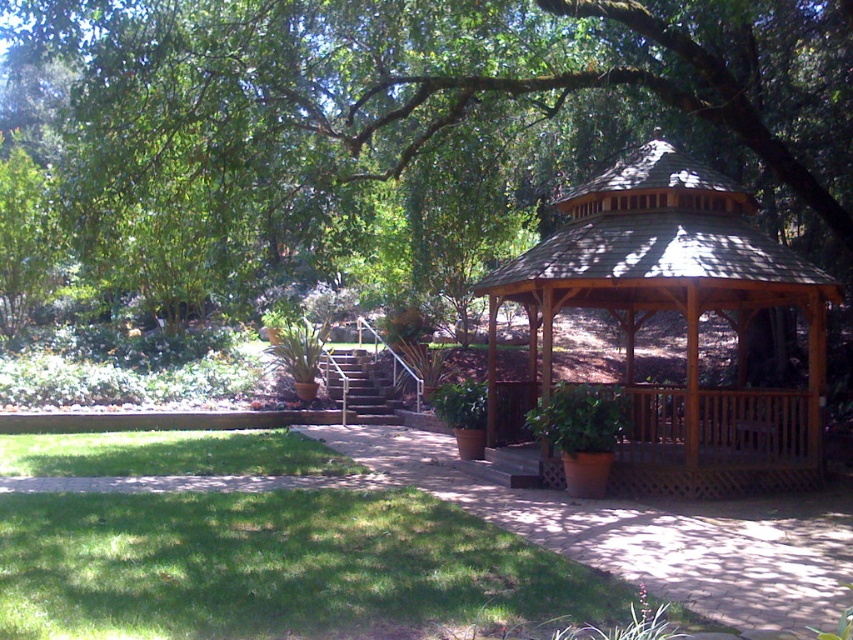
Question: Can you confirm if green leafy tree at center is positioned below green grass at lower left?

Choices:
 (A) yes
 (B) no

Answer: (B)

Question: Can you confirm if green grass at lower left is wider than wooden gazebo at center?

Choices:
 (A) yes
 (B) no

Answer: (A)

Question: Is green leafy tree at center bigger than brown wooden path at center?

Choices:
 (A) yes
 (B) no

Answer: (A)

Question: Among these points, which one is farthest from the camera?

Choices:
 (A) (817, 556)
 (B) (581, 237)
 (C) (186, 224)
 (D) (215, 449)

Answer: (C)

Question: Which is farther from the wooden gazebo at center?

Choices:
 (A) green grass at lower left
 (B) green leafy tree at center

Answer: (B)

Question: Which point is closer to the camera taking this photo?

Choices:
 (A) tap(708, 211)
 (B) tap(7, 508)
 (C) tap(821, 93)
 (D) tap(793, 627)

Answer: (D)